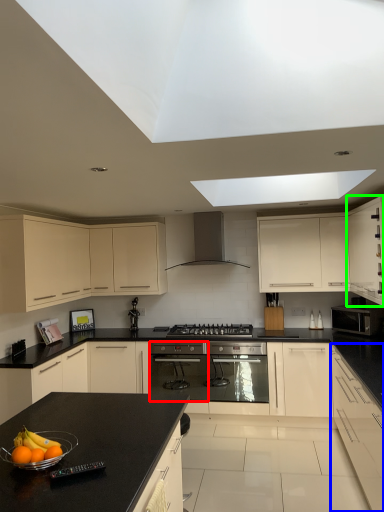
Question: Which is farther away from appliance (highlighted by a red box)? cabinetry (highlighted by a blue box) or cabinetry (highlighted by a green box)?

Choices:
 (A) cabinetry
 (B) cabinetry

Answer: (B)